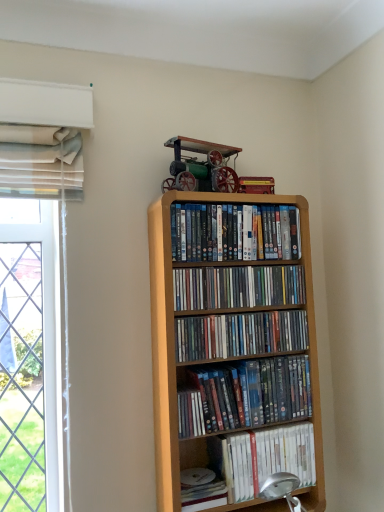
Question: From a real-world perspective, is white matte book at lower right, marked as the 1th book in a bottom-to-top arrangement, under light wood bookcase at center?

Choices:
 (A) yes
 (B) no

Answer: (A)

Question: Is white matte book at lower right, marked as the 1th book in a bottom-to-top arrangement, aimed at light wood bookcase at center?

Choices:
 (A) no
 (B) yes

Answer: (B)

Question: Is white matte book at lower right, the 5th book in the top-to-bottom sequence, to the right of light wood bookcase at center from the viewer's perspective?

Choices:
 (A) no
 (B) yes

Answer: (B)

Question: Is white matte book at lower right, marked as the 1th book in a bottom-to-top arrangement, outside light wood bookcase at center?

Choices:
 (A) yes
 (B) no

Answer: (B)

Question: Is white matte book at lower right, marked as the 1th book in a bottom-to-top arrangement, bigger than light wood bookcase at center?

Choices:
 (A) no
 (B) yes

Answer: (A)

Question: In the image, is white matte paperback book at lower center positioned in front of or behind white matte book at lower right, the 5th book in the top-to-bottom sequence?

Choices:
 (A) behind
 (B) front

Answer: (B)

Question: From their relative heights in the image, would you say white matte paperback book at lower center is taller or shorter than white matte book at lower right, the 5th book in the top-to-bottom sequence?

Choices:
 (A) short
 (B) tall

Answer: (A)

Question: Based on their sizes in the image, would you say white matte paperback book at lower center is bigger or smaller than white matte book at lower right, marked as the 1th book in a bottom-to-top arrangement?

Choices:
 (A) small
 (B) big

Answer: (A)

Question: Would you say white matte paperback book at lower center is inside or outside white matte book at lower right, marked as the 1th book in a bottom-to-top arrangement?

Choices:
 (A) outside
 (B) inside

Answer: (A)

Question: Is white matte paperback book at lower center in front of or behind matte plastic dvds at center, the 3th book when ordered from top to bottom, in the image?

Choices:
 (A) behind
 (B) front

Answer: (B)

Question: Is white matte paperback book at lower center spatially inside matte plastic dvds at center, the 3th book when ordered from top to bottom, or outside of it?

Choices:
 (A) outside
 (B) inside

Answer: (A)

Question: Considering the positions of point coord(196,481) and point coord(226,348), is point coord(196,481) closer or farther from the camera than point coord(226,348)?

Choices:
 (A) closer
 (B) farther

Answer: (A)

Question: From the image's perspective, is white matte paperback book at lower center above or below matte plastic dvds at center, the 3th book when ordered from top to bottom?

Choices:
 (A) below
 (B) above

Answer: (A)

Question: Considering their positions, is white matte paperback book at lower center located in front of or behind matte plastic dvds at upper center, the first book viewed from the top?

Choices:
 (A) front
 (B) behind

Answer: (A)

Question: Is white matte paperback book at lower center inside or outside of matte plastic dvds at upper center, the first book viewed from the top?

Choices:
 (A) inside
 (B) outside

Answer: (B)